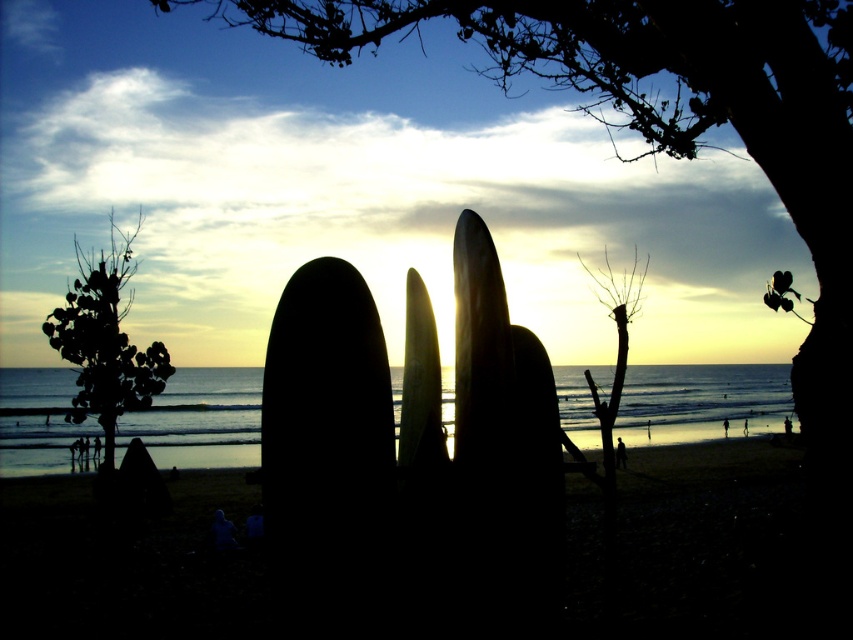
Which of these two, glossy wood surfboard at center or shiny yellow surfboard at center, stands shorter?

With less height is shiny yellow surfboard at center.

Does glossy wood surfboard at center appear on the right side of shiny yellow surfboard at center?

Yes, glossy wood surfboard at center is to the right of shiny yellow surfboard at center.

Identify the location of glossy wood surfboard at center. The height and width of the screenshot is (640, 853). (480, 349).

Is black matte surfboard at center in front of shiny yellow surfboard at center?

That is True.

Does black matte surfboard at center have a greater height compared to shiny yellow surfboard at center?

Yes, black matte surfboard at center is taller than shiny yellow surfboard at center.

You are a GUI agent. You are given a task and a screenshot of the screen. Output one action in this format:
    pyautogui.click(x=<x>, y=<y>)
    Task: Click on the black matte surfboard at center
    
    Given the screenshot: What is the action you would take?
    pyautogui.click(x=326, y=412)

Which is more to the left, dark sand at lower center or green leafy tree at left?

green leafy tree at left

Between dark sand at lower center and green leafy tree at left, which one is positioned higher?

green leafy tree at left

Where is `dark sand at lower center`? The height and width of the screenshot is (640, 853). dark sand at lower center is located at coordinates (722, 545).

Where is `dark sand at lower center`? dark sand at lower center is located at coordinates (722, 545).